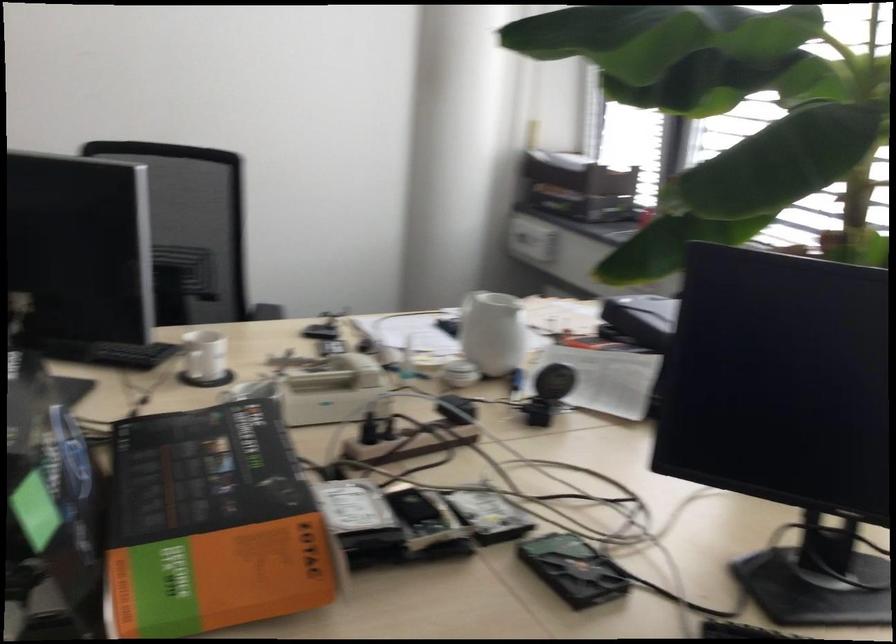
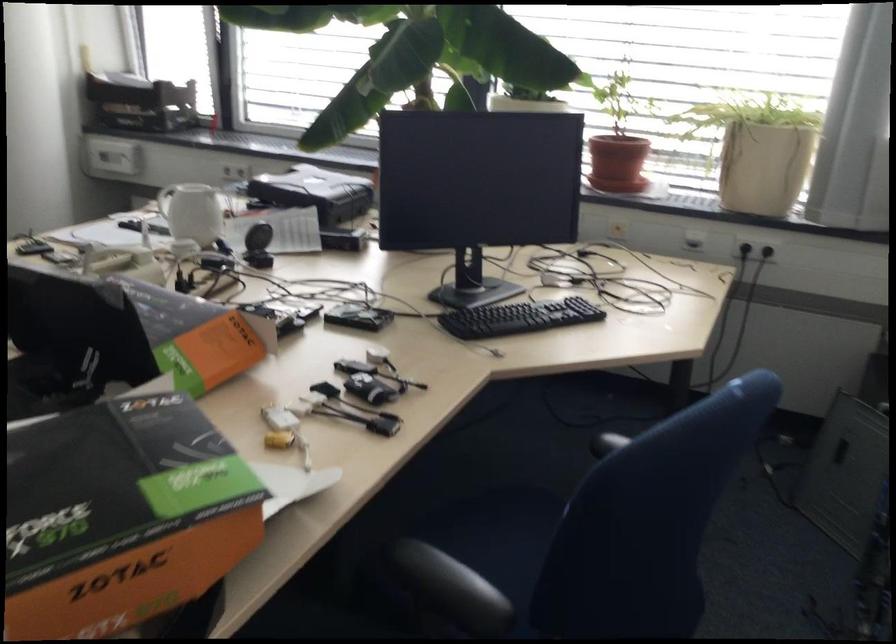
Where in the second image is the point corresponding to [460,299] from the first image?

(165, 200)